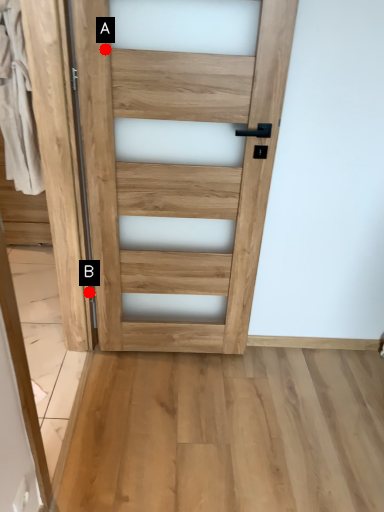
Question: Two points are circled on the image, labeled by A and B beside each circle. Which of the following is the farthest from the observer?

Choices:
 (A) A is further
 (B) B is further

Answer: (B)